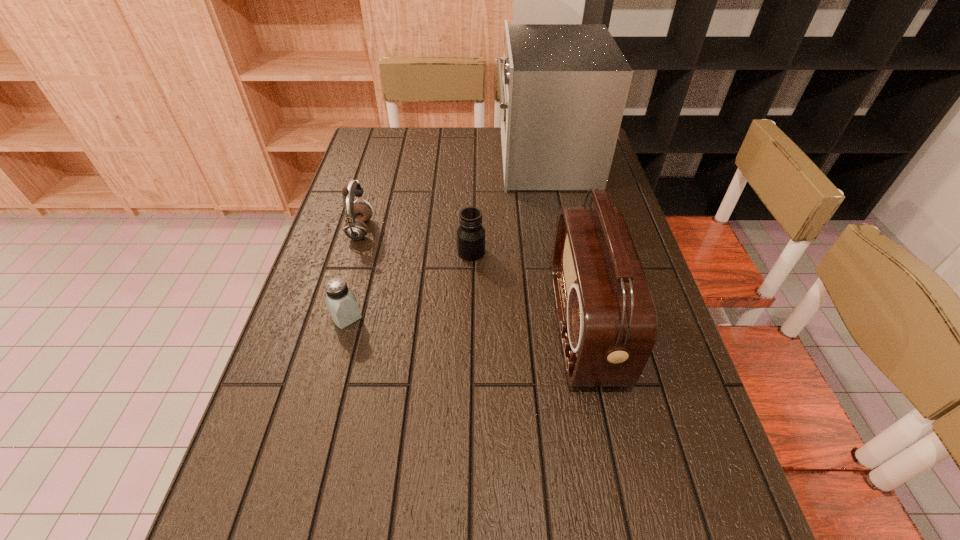
Find the location of a particular element. Image resolution: width=960 pixels, height=540 pixels. vacant space located 0.270m on the front panel of the radio receiver is located at coordinates (438, 327).

Find the location of a particular element. The width and height of the screenshot is (960, 540). free spot located on the front panel of the radio receiver is located at coordinates (446, 327).

The height and width of the screenshot is (540, 960). I want to click on vacant space located 0.160m on the ear pads of the earphone, so click(x=429, y=231).

You are a GUI agent. You are given a task and a screenshot of the screen. Output one action in this format:
    pyautogui.click(x=<x>, y=<y>)
    Task: Click on the vacant space located 0.090m on the front of the third object from left to right
    Image resolution: width=960 pixels, height=540 pixels.
    Given the screenshot: What is the action you would take?
    pyautogui.click(x=470, y=287)

Locate an element on the screen. free location located 0.140m on the front of the shortest object is located at coordinates (328, 386).

I want to click on object at the far edge, so click(564, 87).

What are the coordinates of `earphone present at the left edge` in the screenshot? It's located at (356, 214).

Locate an element on the screen. This screenshot has height=540, width=960. saltshaker present at the left edge is located at coordinates (341, 302).

Where is `toaster oven located at the right edge`? This screenshot has height=540, width=960. toaster oven located at the right edge is located at coordinates (564, 87).

At what (x,y) coordinates should I click in order to perform the action: click on radio receiver that is positioned at the right edge. Please return your answer as a coordinate pair (x, y). The height and width of the screenshot is (540, 960). Looking at the image, I should click on (607, 319).